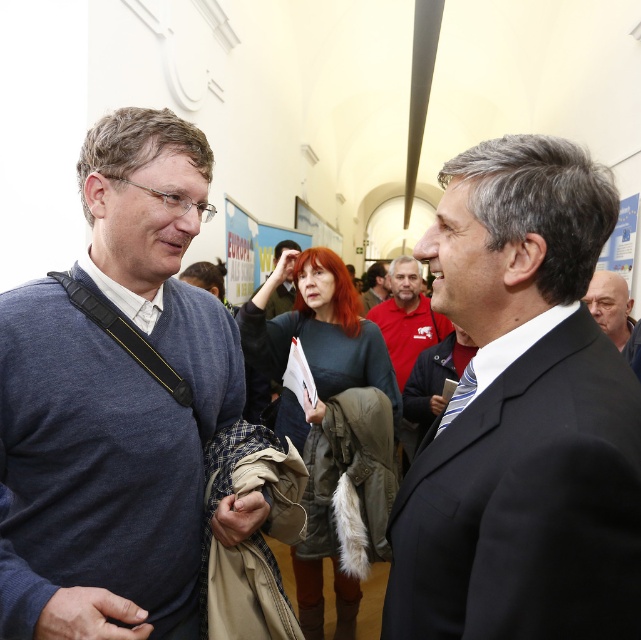
Question: Estimate the real-world distances between objects in this image. Which object is farther from the dark blue sweater at center?

Choices:
 (A) bald head at right
 (B) black suit at center
 (C) red matte shirt at center
 (D) red shirt at center

Answer: (D)

Question: Estimate the real-world distances between objects in this image. Which object is closer to the red matte shirt at center?

Choices:
 (A) bald head at right
 (B) black suit at center
 (C) dark blue sweater at center

Answer: (A)

Question: Can you confirm if dark blue sweater at center is positioned to the left of red shirt at center?

Choices:
 (A) yes
 (B) no

Answer: (A)

Question: Which is farther from the bald head at right?

Choices:
 (A) dark blue sweater at center
 (B) red matte shirt at center
 (C) red shirt at center
 (D) black suit at center

Answer: (C)

Question: Can you confirm if red matte shirt at center is smaller than red shirt at center?

Choices:
 (A) no
 (B) yes

Answer: (A)

Question: Is dark blue sweater at center to the left of red shirt at center from the viewer's perspective?

Choices:
 (A) yes
 (B) no

Answer: (A)